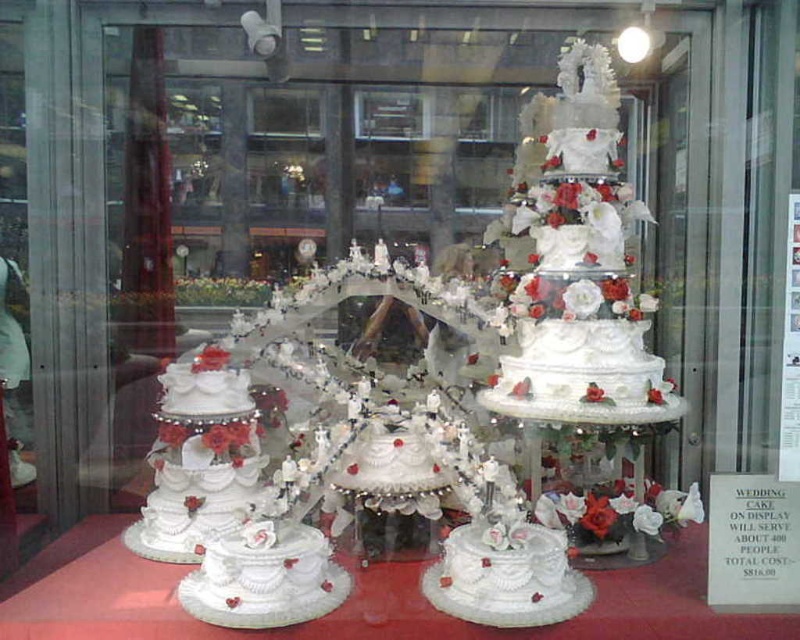
Describe the element at coordinates (582, 273) in the screenshot. I see `white textured cake at center` at that location.

What are the coordinates of `white textured cake at center` in the screenshot? It's located at (582, 273).